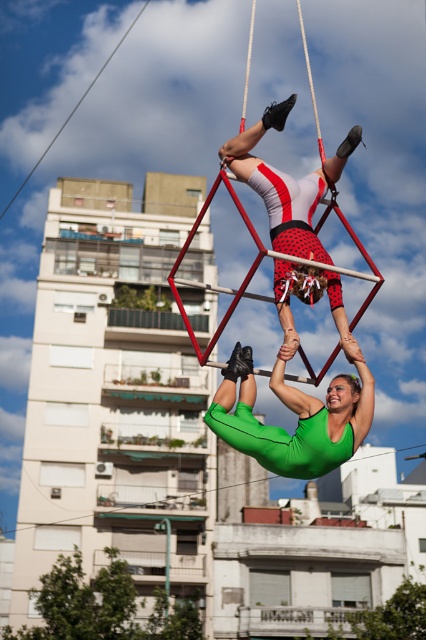
You are a photographer capturing this aerial performance. You need to adjust your camera settings to ensure both the green matte leotard at center and the matte red and white leotard at center are in focus. Considering their sizes, which leotard should you focus on first to ensure proper framing?

The green matte leotard at center is smaller in size compared to the matte red and white leotard at center. To ensure proper framing, focus on the smaller green matte leotard at center first to account for its size relative to the larger one.

You are a stagehand assessing the safety of the performers. You notice the green matte leotard at center and the metallic red swing at center. Which object has a smaller width?

The green matte leotard at center is thinner than the metallic red swing at center, so the green matte leotard at center has a smaller width.

You are a photographer positioned in front of the performers. You want to capture a photo where the green matte leotard at center is in focus while keeping the metallic red swing at center slightly blurred in the background. Is this possible based on their positions?

Yes, since the green matte leotard at center is closer to you than the metallic red swing at center, you can focus on the leotard and have the swing blurred in the background.